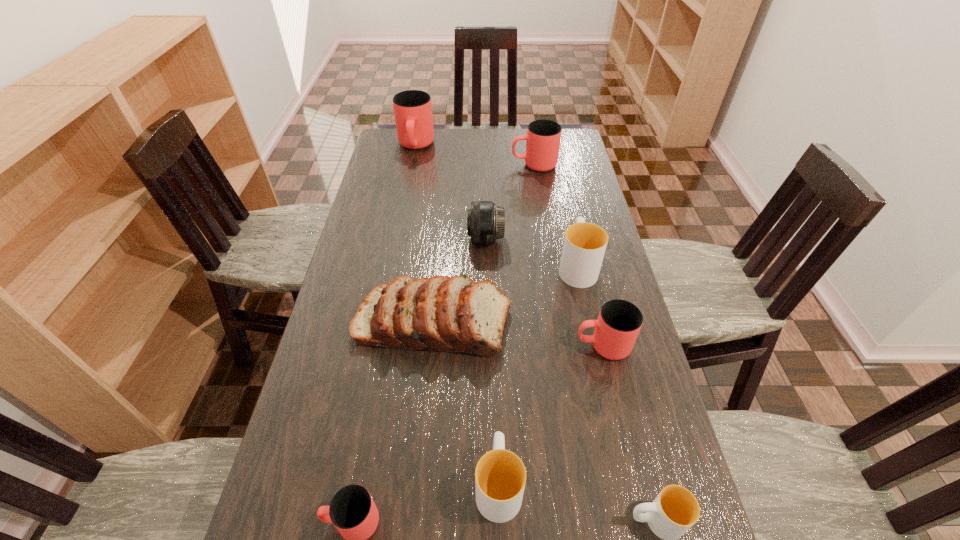
Where is `vacant space located 0.050m on the front-facing side of the telephoto lens`? The width and height of the screenshot is (960, 540). vacant space located 0.050m on the front-facing side of the telephoto lens is located at coordinates (452, 239).

Find the location of a particular element. This screenshot has width=960, height=540. vacant space positioned on the back of the bread is located at coordinates (442, 230).

What are the coordinates of `free space located 0.300m on the handle side of the third biggest pink cup` in the screenshot? It's located at (459, 346).

I want to click on blank area located on the handle side of the third biggest pink cup, so click(x=551, y=346).

What are the coordinates of `free point located 0.150m on the handle side of the third biggest pink cup` in the screenshot? It's located at (516, 346).

In order to click on free space located with the handle on the side of the second smallest yellow cup in this screenshot , I will do `click(495, 387)`.

Find the location of `blank space located with the handle on the side of the second smallest yellow cup`. blank space located with the handle on the side of the second smallest yellow cup is located at coordinates (495, 376).

Image resolution: width=960 pixels, height=540 pixels. I want to click on blank space located 0.070m with the handle on the side of the second smallest yellow cup, so [x=496, y=418].

Locate an element on the screen. cup located at the left edge is located at coordinates (413, 110).

The height and width of the screenshot is (540, 960). I want to click on bread that is at the left edge, so click(453, 314).